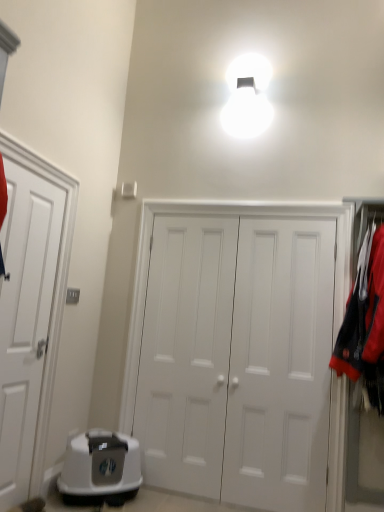
I want to click on free space in front of white matte door at center, placed as the 2th door when sorted from right to left, so click(x=178, y=499).